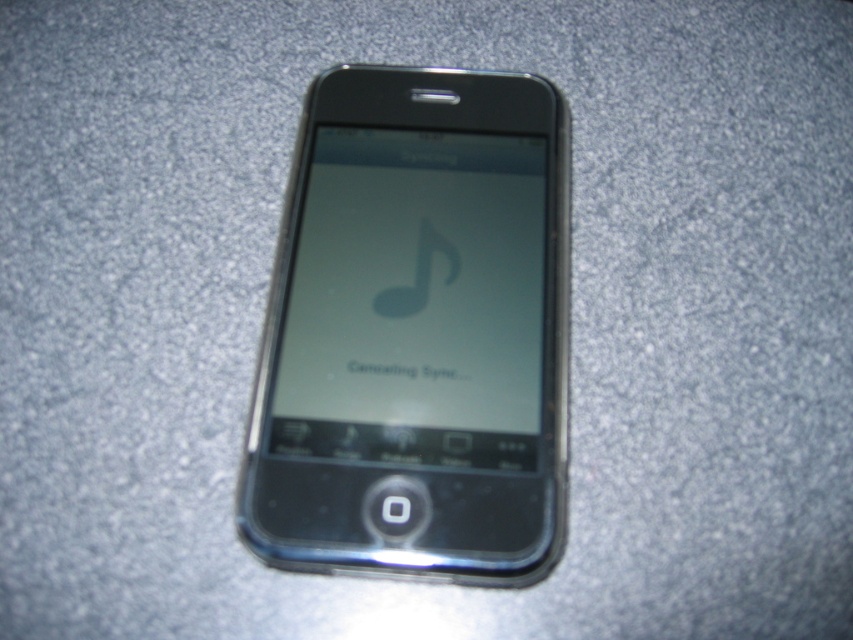
You are using the smartphone shown in the scene. You notice two points on the screen. The first point is at coordinates point [453,490] and the second is at point [318,316]. Which point is closer to you, the user, when looking at the phone?

Point [453,490] is in front of point [318,316], so the first point is closer to you.

Looking at this image, you are a delivery robot that needs to place a small package on the surface where the black glossy smartphone at center is located. The package is 10 cm wide. Can you place it without moving the smartphone?

The black glossy smartphone at center is located at point (x=416, y=333), so yes, you can place the package next to it without moving the smartphone as there is space available on the surface.

You have a protective case that fits devices up to 13 cm in width. You are holding the black glossy smartphone at center and want to place it into the case. Can you determine if the smartphone will fit based on its width compared to the matte glass screen at center?

The black glossy smartphone at center is wider than the matte glass screen at center. Since the case fits up to 13 cm, but we don not know the exact width of the smartphone, we cannot confirm if it will fit. Please measure the smartphone first.